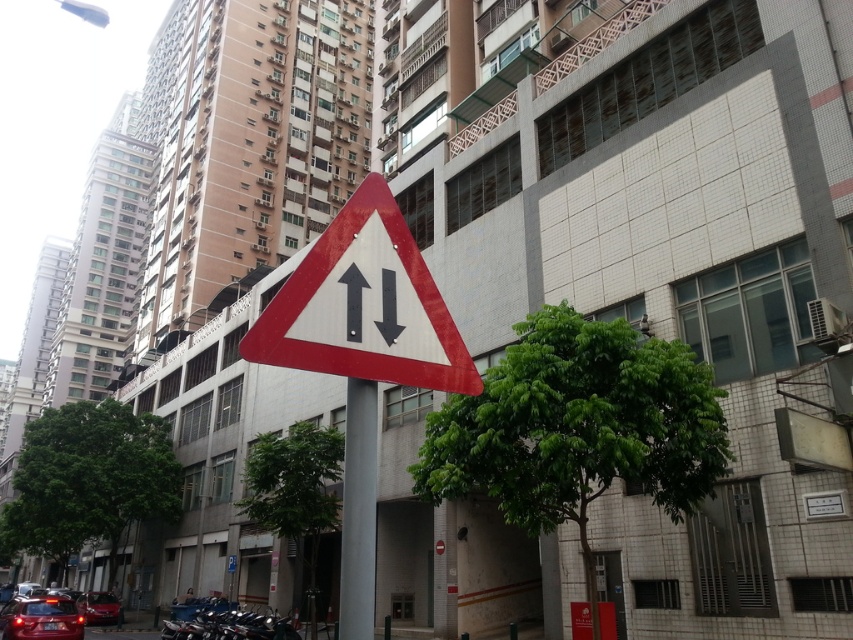
Is black glossy arrow at center to the right of metallic red car at lower left from the viewer's perspective?

Indeed, black glossy arrow at center is positioned on the right side of metallic red car at lower left.

Image resolution: width=853 pixels, height=640 pixels. Identify the location of black glossy arrow at center. (352, 301).

You are a GUI agent. You are given a task and a screenshot of the screen. Output one action in this format:
    pyautogui.click(x=<x>, y=<y>)
    Task: Click on the black glossy arrow at center
    This screenshot has height=640, width=853.
    Given the screenshot: What is the action you would take?
    pyautogui.click(x=352, y=301)

In the scene shown: Can you confirm if green leafy tree at lower center is taller than black glossy arrow at center?

Indeed, green leafy tree at lower center has a greater height compared to black glossy arrow at center.

Does point (270, 508) come behind point (351, 273)?

Yes.

The image size is (853, 640). What are the coordinates of `green leafy tree at lower center` in the screenshot? It's located at (294, 490).

Can you confirm if reflective plastic triangle at center is shorter than black matte arrow at center?

No.

At what (x,y) coordinates should I click in order to perform the action: click on reflective plastic triangle at center. Please return your answer as a coordinate pair (x, y). The height and width of the screenshot is (640, 853). Looking at the image, I should click on (363, 305).

Find the location of `reflective plastic triangle at center`. reflective plastic triangle at center is located at coordinates (363, 305).